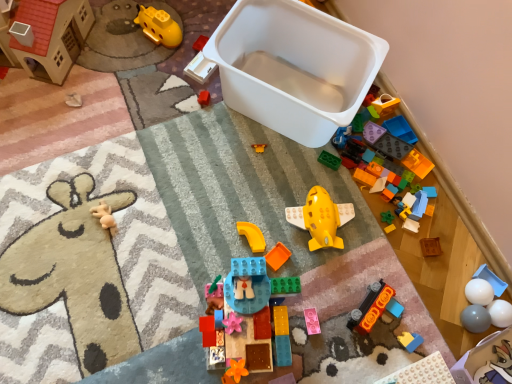
Where is `vacant space that is in between matte plastic toy at lower right, which is counted as the 12th toy, starting from the left, and yellow plastic submarine at upper left, which appears as the third toy when viewed from the left`? Image resolution: width=512 pixels, height=384 pixels. vacant space that is in between matte plastic toy at lower right, which is counted as the 12th toy, starting from the left, and yellow plastic submarine at upper left, which appears as the third toy when viewed from the left is located at coordinates (257, 158).